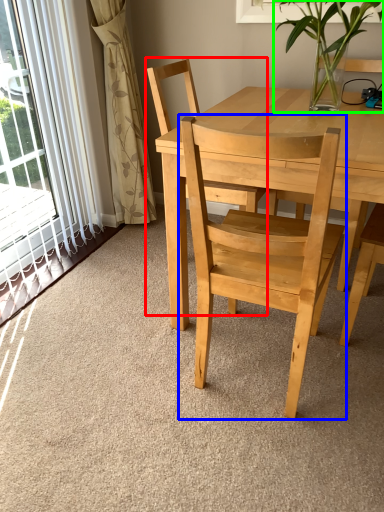
Question: Estimate the real-world distances between objects in this image. Which object is closer to chair (highlighted by a red box), chair (highlighted by a blue box) or houseplant (highlighted by a green box)?

Choices:
 (A) chair
 (B) houseplant

Answer: (B)